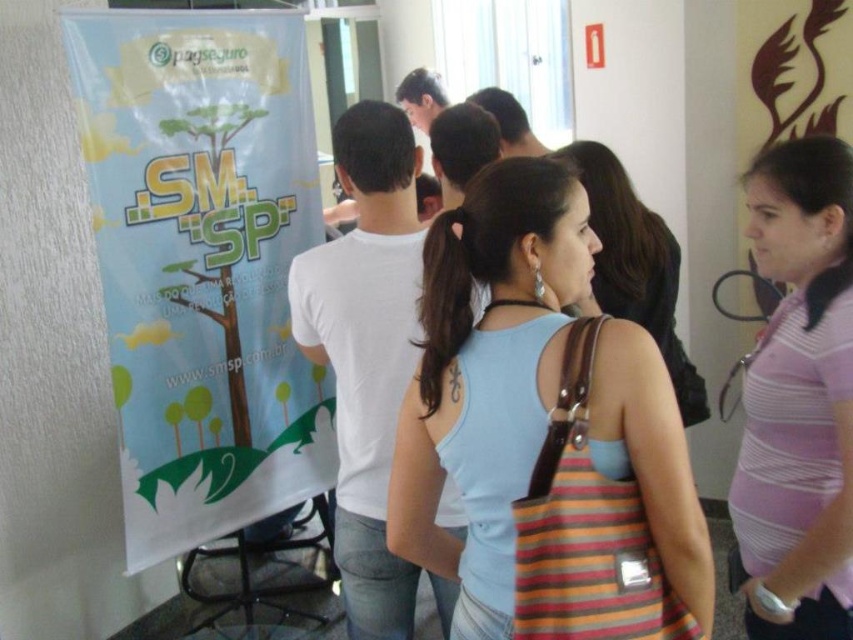
Question: Is the position of light blue tank top at center more distant than that of pink striped shirt at center?

Choices:
 (A) no
 (B) yes

Answer: (A)

Question: Considering the relative positions of light blue tank top at center and pink striped shirt at center in the image provided, where is light blue tank top at center located with respect to pink striped shirt at center?

Choices:
 (A) above
 (B) below

Answer: (A)

Question: Which object is farther from the camera taking this photo?

Choices:
 (A) light blue tank top at center
 (B) pink striped shirt at center

Answer: (B)

Question: Does light blue tank top at center have a smaller size compared to pink striped shirt at center?

Choices:
 (A) yes
 (B) no

Answer: (B)

Question: Among these points, which one is nearest to the camera?

Choices:
 (A) (805, 492)
 (B) (489, 465)

Answer: (B)